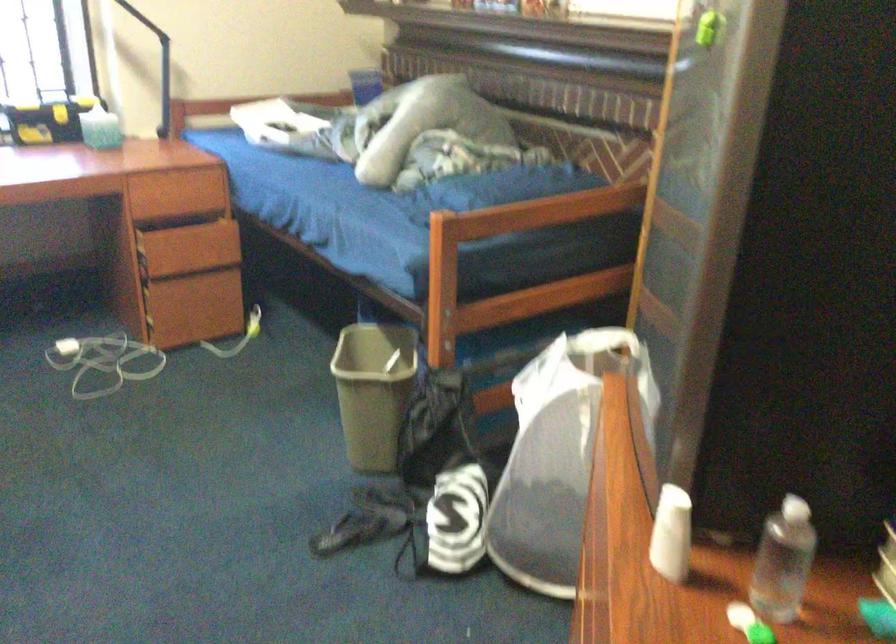
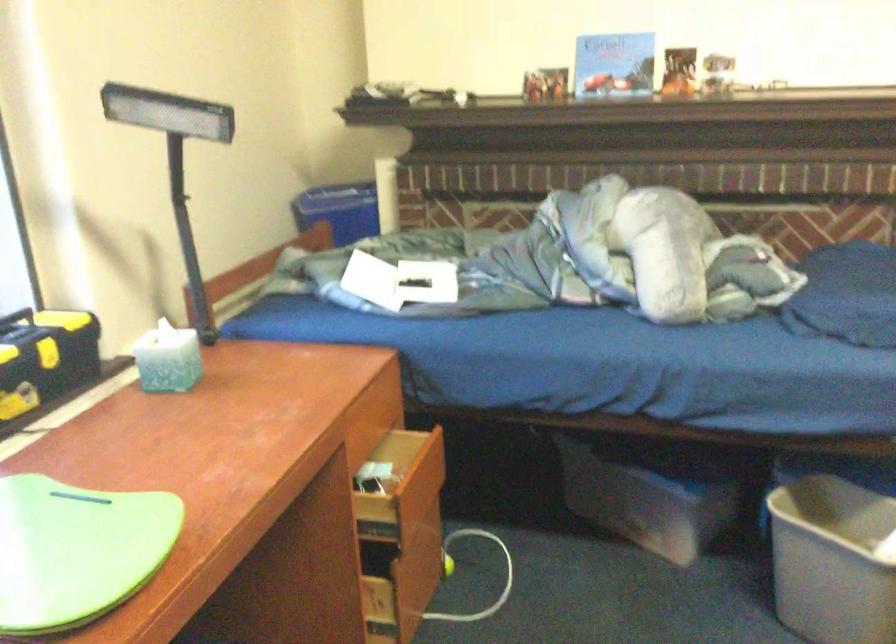
Locate, in the second image, the point that corresponds to point 362,79 in the first image.

(339, 210)